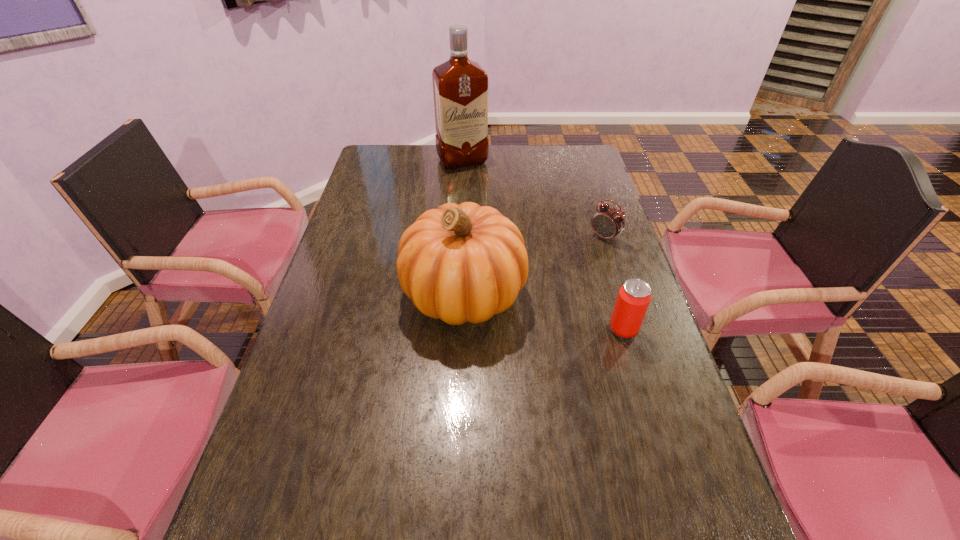
Where is `pumpkin`? pumpkin is located at coordinates (461, 263).

You are a GUI agent. You are given a task and a screenshot of the screen. Output one action in this format:
    pyautogui.click(x=<x>, y=<y>)
    Task: Click on the beer can
    
    Given the screenshot: What is the action you would take?
    pyautogui.click(x=634, y=297)

Find the location of `alarm clock`. alarm clock is located at coordinates (607, 222).

Identify the location of the farthest object. This screenshot has height=540, width=960. (460, 86).

Where is `the tallest object`? Image resolution: width=960 pixels, height=540 pixels. the tallest object is located at coordinates (x=460, y=86).

At what (x,y) coordinates should I click in order to perform the action: click on vacant space positioned on the back of the pumpkin. Please return your answer as a coordinate pair (x, y). Image resolution: width=960 pixels, height=540 pixels. Looking at the image, I should click on (467, 219).

Locate an element on the screen. The width and height of the screenshot is (960, 540). free region located on the front of the beer can is located at coordinates (638, 378).

Locate an element on the screen. Image resolution: width=960 pixels, height=540 pixels. vacant space located 0.120m on the face of the second farthest object is located at coordinates (574, 262).

In order to click on vacant space located 0.300m on the face of the second farthest object in this screenshot , I will do `click(536, 294)`.

Locate an element on the screen. Image resolution: width=960 pixels, height=540 pixels. vacant space located 0.270m on the face of the second farthest object is located at coordinates (542, 288).